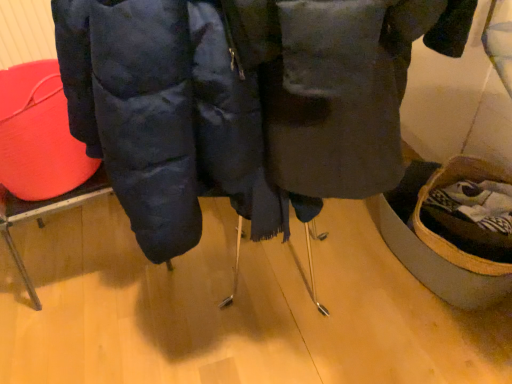
You are a GUI agent. You are given a task and a screenshot of the screen. Output one action in this format:
    pyautogui.click(x=<x>, y=<y>)
    Task: Click on the free point below matte blue jacket at center (from a real-world perspective)
    
    Given the screenshot: What is the action you would take?
    pyautogui.click(x=275, y=294)